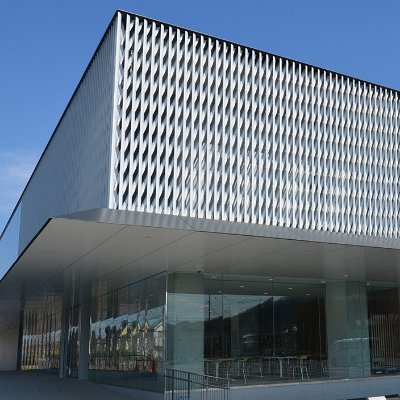
I want to click on windows, so click(46, 349), click(110, 343), click(148, 340), click(195, 336), click(266, 329), click(318, 325), click(367, 323).